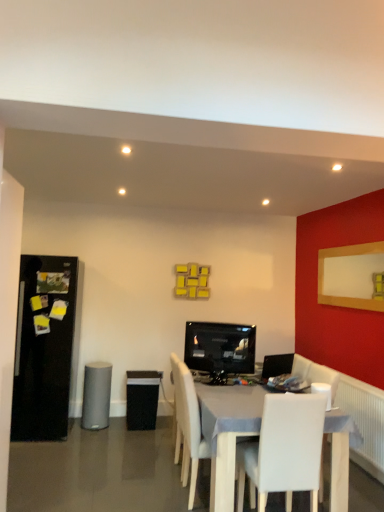
Where is `free space to the left of white wood chair at center, placed as the first chair when sorted from back to front`? This screenshot has height=512, width=384. free space to the left of white wood chair at center, placed as the first chair when sorted from back to front is located at coordinates (154, 493).